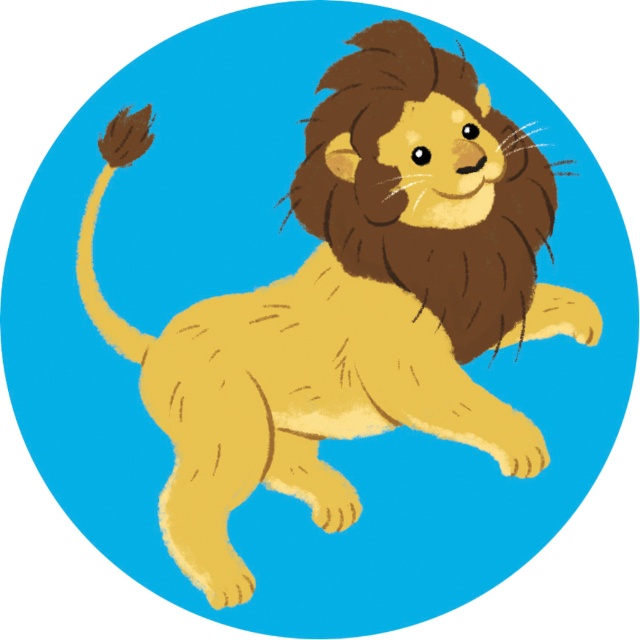
You are an artist sketching the lion from the image. You want to draw the brown fuzzy mane at center and the brown fuzzy tail at upper left. Which part should you draw first to follow the correct layering order?

The brown fuzzy mane at center should be drawn first because it is closer to the viewer than the brown fuzzy tail at upper left, so it should appear layered on top.